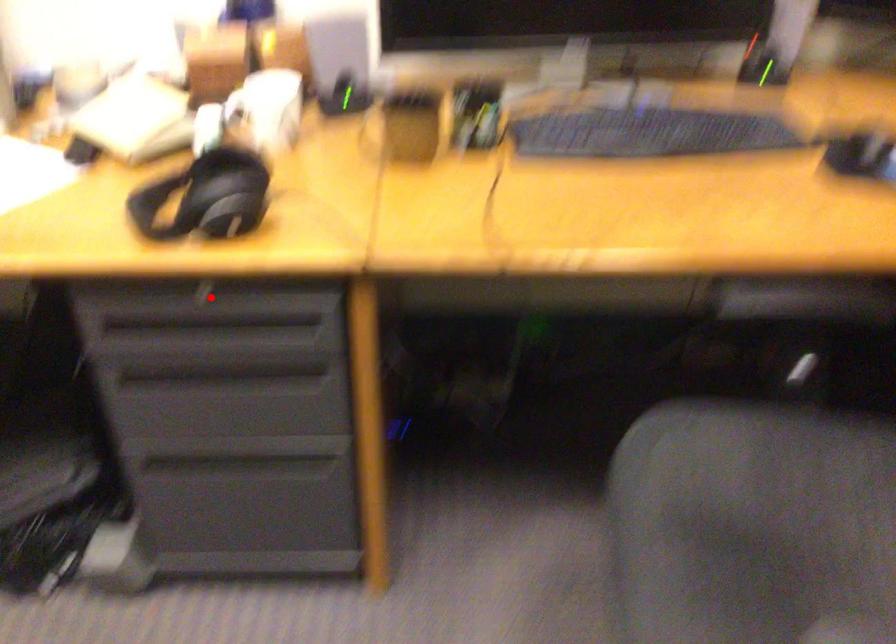
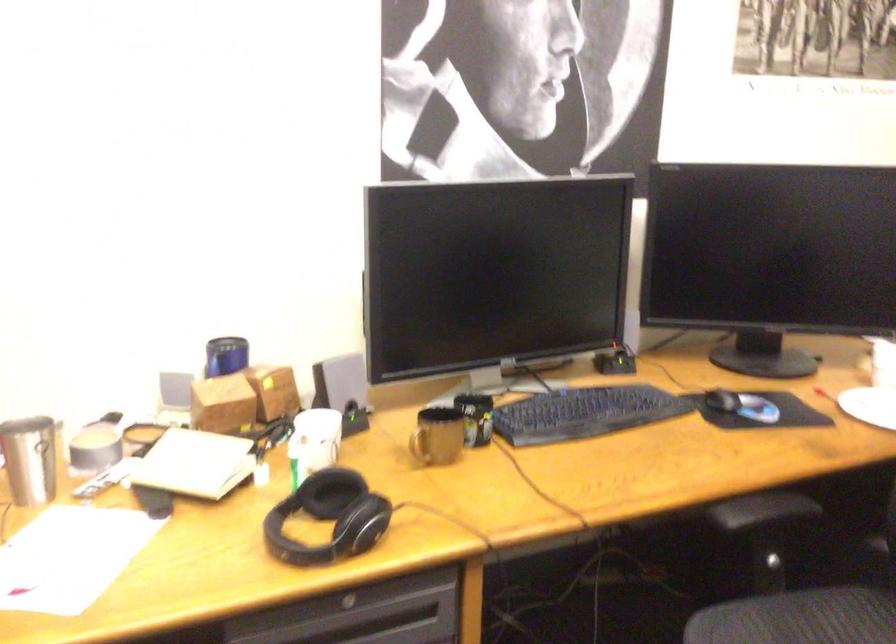
Find the pixel in the second image that matches the highlighted location in the first image.

(347, 603)